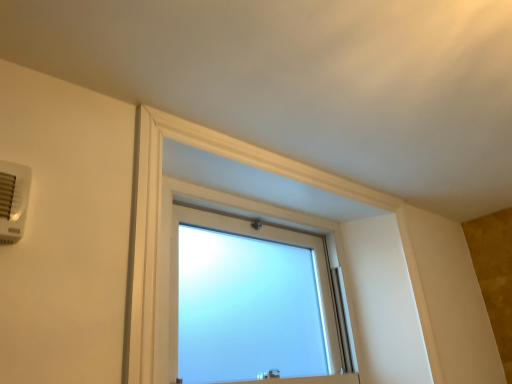
Question: Is frosted glass window at center not within white plastic air conditioning unit at upper left?

Choices:
 (A) no
 (B) yes

Answer: (B)

Question: From the image's perspective, is frosted glass window at center under white plastic air conditioning unit at upper left?

Choices:
 (A) yes
 (B) no

Answer: (A)

Question: Does frosted glass window at center have a lesser height compared to white plastic air conditioning unit at upper left?

Choices:
 (A) no
 (B) yes

Answer: (A)

Question: From the image's perspective, is frosted glass window at center over white plastic air conditioning unit at upper left?

Choices:
 (A) no
 (B) yes

Answer: (A)

Question: Is frosted glass window at center positioned far away from white plastic air conditioning unit at upper left?

Choices:
 (A) yes
 (B) no

Answer: (B)

Question: Considering the relative sizes of frosted glass window at center and white plastic air conditioning unit at upper left in the image provided, is frosted glass window at center bigger than white plastic air conditioning unit at upper left?

Choices:
 (A) no
 (B) yes

Answer: (B)

Question: Is frosted glass window at center turned away from frosted glass window at upper center?

Choices:
 (A) no
 (B) yes

Answer: (B)

Question: From the image's perspective, is frosted glass window at center over frosted glass window at upper center?

Choices:
 (A) no
 (B) yes

Answer: (A)

Question: Is frosted glass window at center thinner than frosted glass window at upper center?

Choices:
 (A) no
 (B) yes

Answer: (A)

Question: From a real-world perspective, is frosted glass window at center physically above frosted glass window at upper center?

Choices:
 (A) yes
 (B) no

Answer: (B)

Question: Is frosted glass window at center located outside frosted glass window at upper center?

Choices:
 (A) no
 (B) yes

Answer: (B)

Question: Is frosted glass window at center at the right side of frosted glass window at upper center?

Choices:
 (A) yes
 (B) no

Answer: (B)

Question: Is frosted glass window at upper center bigger than frosted glass window at center?

Choices:
 (A) no
 (B) yes

Answer: (A)